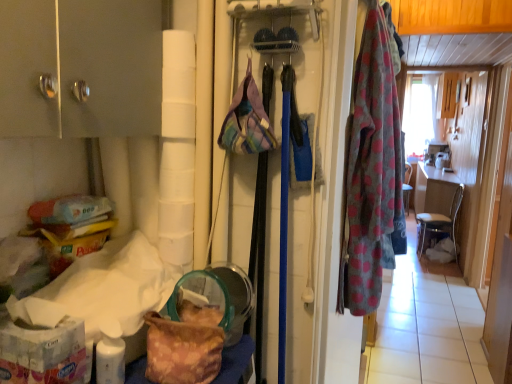
Question: Is polka dot fabric robe at right to the right of matte silver cabinet at upper left from the viewer's perspective?

Choices:
 (A) yes
 (B) no

Answer: (A)

Question: Is polka dot fabric robe at right not inside matte silver cabinet at upper left?

Choices:
 (A) no
 (B) yes

Answer: (B)

Question: Is the position of polka dot fabric robe at right less distant than that of matte silver cabinet at upper left?

Choices:
 (A) no
 (B) yes

Answer: (A)

Question: From a real-world perspective, is polka dot fabric robe at right below matte silver cabinet at upper left?

Choices:
 (A) no
 (B) yes

Answer: (B)

Question: Is polka dot fabric robe at right smaller than matte silver cabinet at upper left?

Choices:
 (A) yes
 (B) no

Answer: (A)

Question: From a real-world perspective, is matte silver cabinet at upper left physically located above or below camouflage fabric bag at lower left, positioned as the 2th handbag in top-to-bottom order?

Choices:
 (A) below
 (B) above

Answer: (B)

Question: Considering the positions of matte silver cabinet at upper left and camouflage fabric bag at lower left, the 1th handbag when ordered from bottom to top, in the image, is matte silver cabinet at upper left taller or shorter than camouflage fabric bag at lower left, the 1th handbag when ordered from bottom to top,?

Choices:
 (A) short
 (B) tall

Answer: (B)

Question: From the image's perspective, relative to camouflage fabric bag at lower left, positioned as the 2th handbag in top-to-bottom order, is matte silver cabinet at upper left above or below?

Choices:
 (A) above
 (B) below

Answer: (A)

Question: Does point (39, 120) appear closer or farther from the camera than point (196, 269)?

Choices:
 (A) closer
 (B) farther

Answer: (A)

Question: In terms of height, does polka dot fabric robe at right look taller or shorter compared to plaid fabric handbag at center, marked as the 2th handbag in a left-to-right arrangement?

Choices:
 (A) tall
 (B) short

Answer: (A)

Question: Is point (367, 69) closer or farther from the camera than point (256, 140)?

Choices:
 (A) closer
 (B) farther

Answer: (B)

Question: Is polka dot fabric robe at right spatially inside plaid fabric handbag at center, marked as the 1th handbag in a right-to-left arrangement, or outside of it?

Choices:
 (A) outside
 (B) inside

Answer: (A)

Question: Considering the positions of polka dot fabric robe at right and plaid fabric handbag at center, marked as the 2th handbag in a left-to-right arrangement, in the image, is polka dot fabric robe at right wider or thinner than plaid fabric handbag at center, marked as the 2th handbag in a left-to-right arrangement,?

Choices:
 (A) thin
 (B) wide

Answer: (B)

Question: From the image's perspective, is metallic silver chair at right located above or below polka dot fabric robe at right?

Choices:
 (A) below
 (B) above

Answer: (A)

Question: Is point (432, 221) closer or farther from the camera than point (377, 59)?

Choices:
 (A) closer
 (B) farther

Answer: (B)